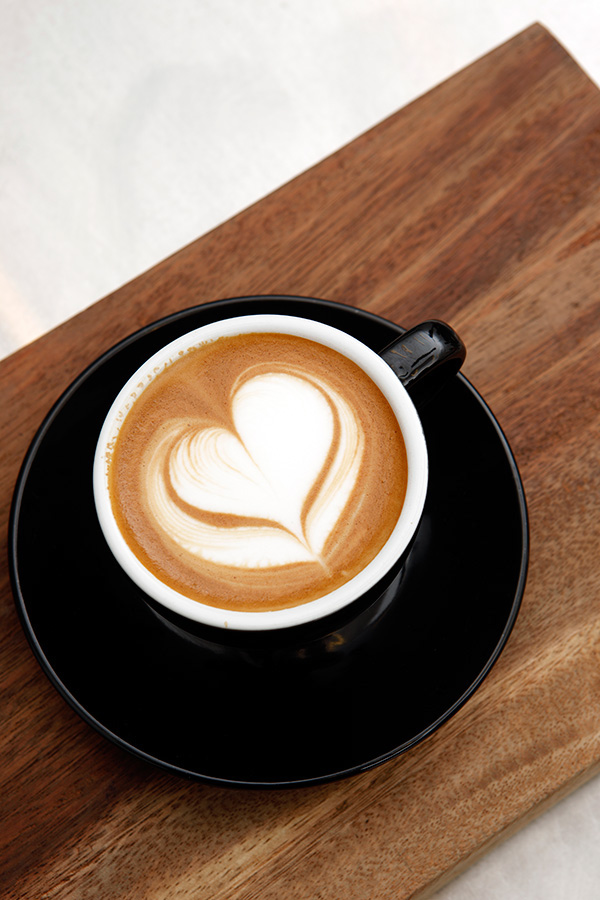
Where is `edge of saucer`? The width and height of the screenshot is (600, 900). edge of saucer is located at coordinates (501, 636).